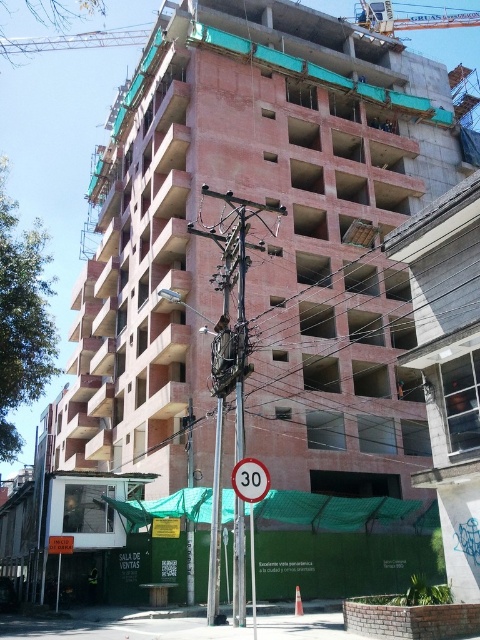
Question: Which point is farther from the camera taking this photo?

Choices:
 (A) (105, 45)
 (B) (243, 496)
 (C) (240, 330)
 (D) (462, 26)

Answer: (A)

Question: Is metallic pole at center positioned behind orange reflective traffic sign at center?

Choices:
 (A) yes
 (B) no

Answer: (A)

Question: Is metallic pole at center thinner than orange reflective traffic sign at center?

Choices:
 (A) yes
 (B) no

Answer: (A)

Question: Estimate the real-world distances between objects in this image. Which object is farther from the metallic pole at center?

Choices:
 (A) brushed metal crane at upper center
 (B) orange reflective traffic sign at center
 (C) metallic gray crane at upper left

Answer: (C)

Question: Which is farther from the orange reflective traffic sign at center?

Choices:
 (A) brushed metal crane at upper center
 (B) metallic pole at center

Answer: (A)

Question: Does metallic pole at center have a smaller size compared to orange reflective traffic sign at center?

Choices:
 (A) no
 (B) yes

Answer: (A)